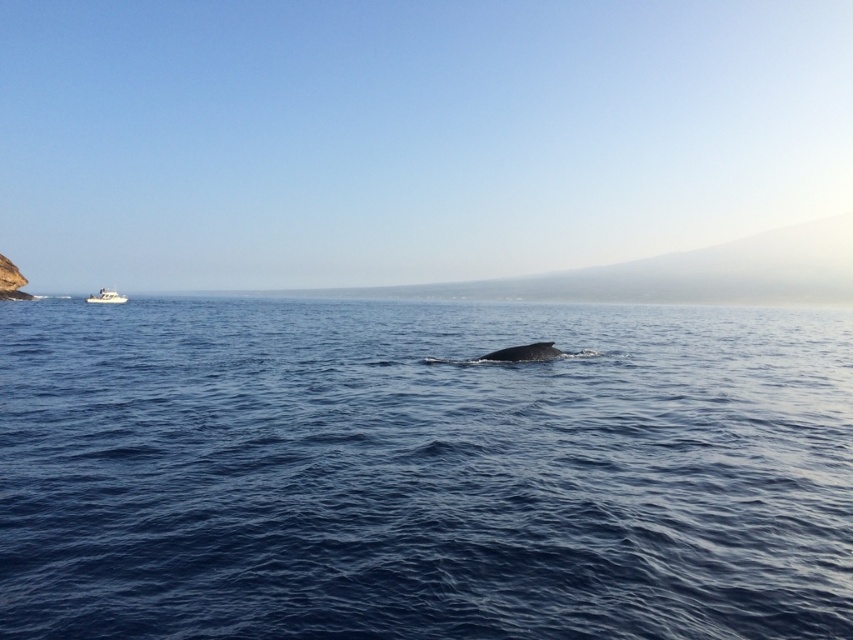
Between gray matte whale at center and white plastic boat at left, which one has more height?

Standing taller between the two is white plastic boat at left.

Is gray matte whale at center wider than white plastic boat at left?

Incorrect, gray matte whale at center's width does not surpass white plastic boat at left's.

Does point (520, 346) lie in front of point (114, 298)?

Yes, point (520, 346) is closer to viewer.

Image resolution: width=853 pixels, height=640 pixels. Identify the location of gray matte whale at center. (524, 353).

Between blue water at center and white plastic boat at left, which one has more height?

blue water at center is taller.

Does blue water at center appear on the right side of white plastic boat at left?

Correct, you'll find blue water at center to the right of white plastic boat at left.

Who is more forward, [419,512] or [105,301]?

Positioned in front is point [419,512].

In order to click on blue water at center in this screenshot , I will do [422, 470].

Is blue water at center thinner than gray matte whale at center?

No.

Can you confirm if blue water at center is smaller than gray matte whale at center?

Actually, blue water at center might be larger than gray matte whale at center.

Does point (724, 488) come behind point (541, 349)?

No, (724, 488) is in front of (541, 349).

The image size is (853, 640). I want to click on blue water at center, so click(422, 470).